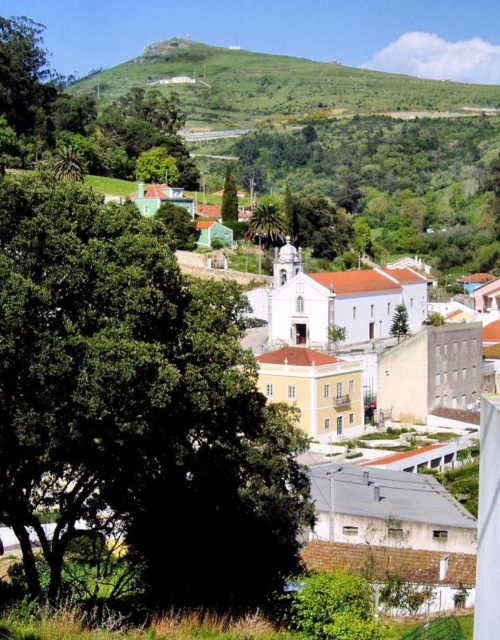
Question: Considering the real-world distances, which object is closest to the green matte tree at center?

Choices:
 (A) green grassy hillside at upper center
 (B) green leafy tree at center

Answer: (B)

Question: Which point is farther to the camera?

Choices:
 (A) (278, 74)
 (B) (228, 202)
 (C) (226, 561)

Answer: (A)

Question: Estimate the real-world distances between objects in this image. Which object is farther from the green leafy tree at center?

Choices:
 (A) green grassy hillside at upper center
 (B) green matte tree at center

Answer: (A)

Question: Is green leafy tree at center above green matte tree at center?

Choices:
 (A) no
 (B) yes

Answer: (A)

Question: Is green leafy tree at center positioned before green grassy hillside at upper center?

Choices:
 (A) no
 (B) yes

Answer: (B)

Question: Can you confirm if green leafy tree at center is bigger than green matte tree at center?

Choices:
 (A) yes
 (B) no

Answer: (A)